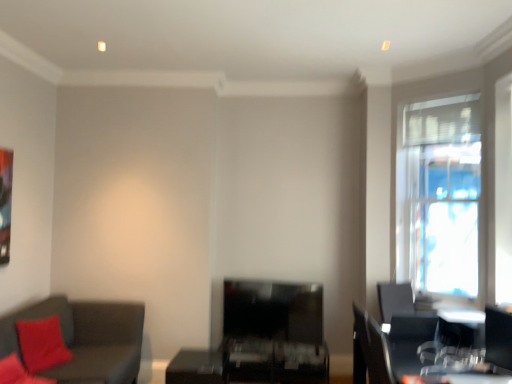
Question: Would you say dark gray fabric couch at lower left is to the left or to the right of black plastic swivel chair at lower right in the picture?

Choices:
 (A) right
 (B) left

Answer: (B)

Question: Does point (8, 322) appear closer or farther from the camera than point (493, 326)?

Choices:
 (A) farther
 (B) closer

Answer: (A)

Question: Which of these objects is positioned closest to the matte black table at center?

Choices:
 (A) transparent glass window at right
 (B) dark gray fabric couch at lower left
 (C) black plastic swivel chair at lower right

Answer: (B)

Question: Which object is the closest to the matte black table at center?

Choices:
 (A) dark gray fabric couch at lower left
 (B) black plastic swivel chair at lower right
 (C) transparent glass window at right

Answer: (A)